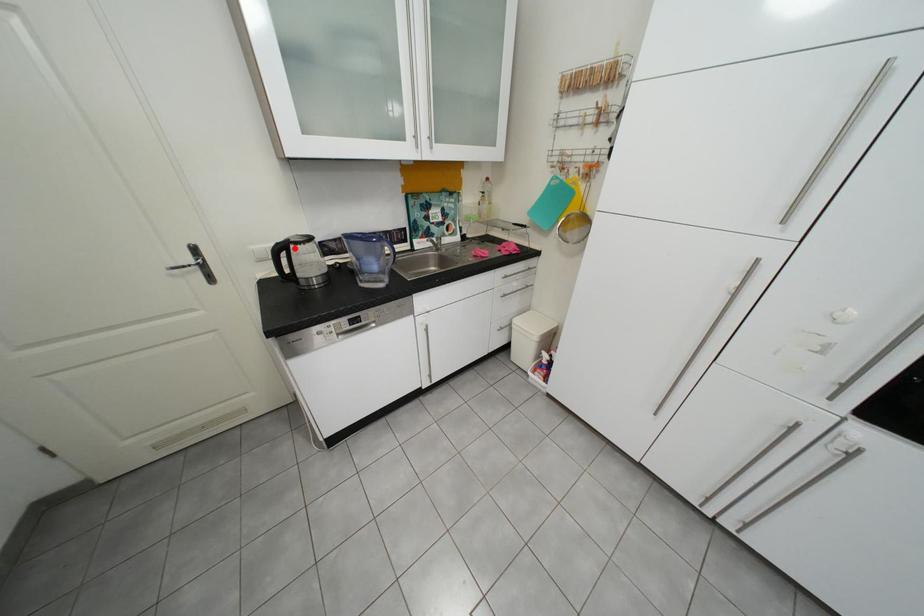
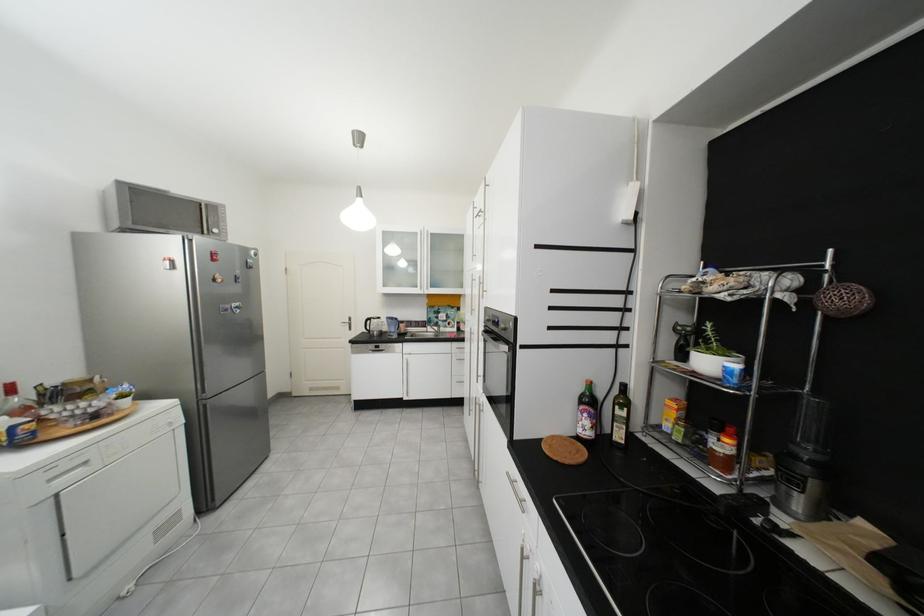
The point at the highlighted location is marked in the first image. Where is the corresponding point in the second image?

(381, 321)